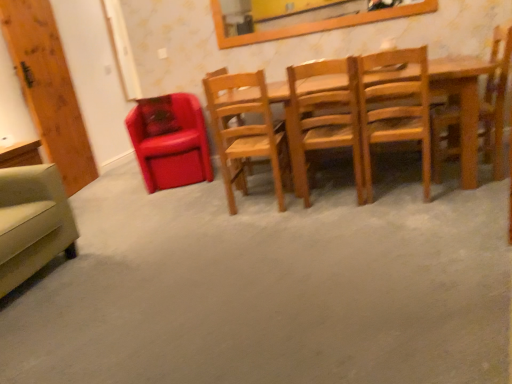
At what (x,y) coordinates should I click in order to perform the action: click on free location in front of matte leather chair at left, the 5th chair viewed from the right. Please return your answer as a coordinate pair (x, y). The width and height of the screenshot is (512, 384). Looking at the image, I should click on (167, 196).